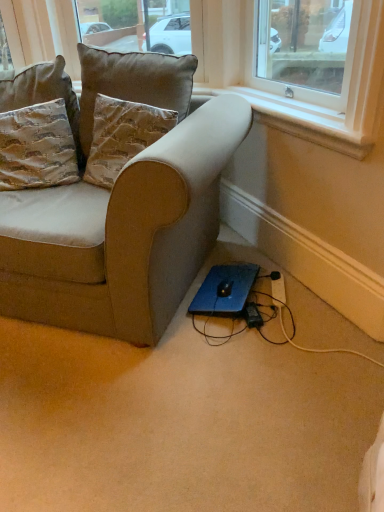
Question: Is suede beige couch at lower left further to camera compared to black plastic extension cord at lower right?

Choices:
 (A) yes
 (B) no

Answer: (B)

Question: From the image's perspective, would you say suede beige couch at lower left is positioned over black plastic extension cord at lower right?

Choices:
 (A) no
 (B) yes

Answer: (B)

Question: Is suede beige couch at lower left turned away from black plastic extension cord at lower right?

Choices:
 (A) yes
 (B) no

Answer: (B)

Question: Is suede beige couch at lower left outside black plastic extension cord at lower right?

Choices:
 (A) yes
 (B) no

Answer: (A)

Question: Considering the relative sizes of suede beige couch at lower left and black plastic extension cord at lower right in the image provided, is suede beige couch at lower left wider than black plastic extension cord at lower right?

Choices:
 (A) no
 (B) yes

Answer: (B)

Question: Considering the relative positions of white plastic window sill at upper right and black plastic plug at lower center in the image provided, is white plastic window sill at upper right to the left or to the right of black plastic plug at lower center?

Choices:
 (A) left
 (B) right

Answer: (B)

Question: Considering their positions, is white plastic window sill at upper right located in front of or behind black plastic plug at lower center?

Choices:
 (A) front
 (B) behind

Answer: (A)

Question: Is white plastic window sill at upper right wider or thinner than black plastic plug at lower center?

Choices:
 (A) thin
 (B) wide

Answer: (A)

Question: Is white plastic window sill at upper right taller or shorter than black plastic plug at lower center?

Choices:
 (A) short
 (B) tall

Answer: (B)

Question: Considering the positions of suede beige couch at lower left and black plastic plug at lower center in the image, is suede beige couch at lower left taller or shorter than black plastic plug at lower center?

Choices:
 (A) tall
 (B) short

Answer: (A)

Question: From the image's perspective, relative to black plastic plug at lower center, is suede beige couch at lower left above or below?

Choices:
 (A) above
 (B) below

Answer: (A)

Question: Is suede beige couch at lower left situated inside black plastic plug at lower center or outside?

Choices:
 (A) outside
 (B) inside

Answer: (A)

Question: Considering the positions of point (38, 219) and point (258, 311), is point (38, 219) closer or farther from the camera than point (258, 311)?

Choices:
 (A) farther
 (B) closer

Answer: (B)

Question: Relative to suede beige couch at lower left, is suede textured pillow at upper left, the second pillow from the right, in front or behind?

Choices:
 (A) front
 (B) behind

Answer: (B)

Question: Looking at the image, does suede textured pillow at upper left, the second pillow from the right, seem bigger or smaller compared to suede beige couch at lower left?

Choices:
 (A) big
 (B) small

Answer: (B)